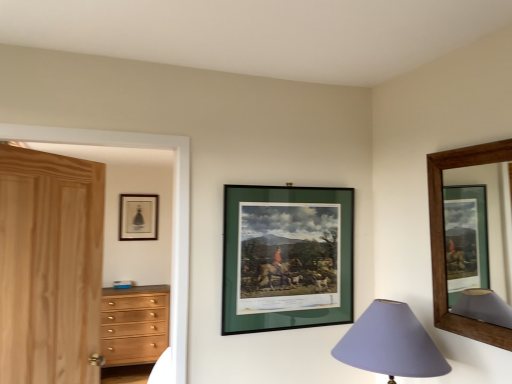
Question: Could you tell me if brown wooden picture frame at upper right, the third picture frame in the back-to-front sequence, is facing natural wood door at left?

Choices:
 (A) no
 (B) yes

Answer: (A)

Question: Is natural wood door at left inside brown wooden picture frame at upper right, which is the 3th picture frame in left-to-right order?

Choices:
 (A) yes
 (B) no

Answer: (B)

Question: From a real-world perspective, is brown wooden picture frame at upper right, acting as the 1th picture frame starting from the front, under natural wood door at left?

Choices:
 (A) no
 (B) yes

Answer: (A)

Question: From a real-world perspective, is brown wooden picture frame at upper right, marked as the 1th picture frame in a right-to-left arrangement, on top of natural wood door at left?

Choices:
 (A) no
 (B) yes

Answer: (B)

Question: From the image's perspective, is brown wooden picture frame at upper right, which is the 3th picture frame in left-to-right order, below natural wood door at left?

Choices:
 (A) no
 (B) yes

Answer: (A)

Question: Based on their positions, is green matte picture frame at center, which ranks as the second picture frame in left-to-right order, located to the left or right of natural wood door at left?

Choices:
 (A) left
 (B) right

Answer: (B)

Question: From the image's perspective, is green matte picture frame at center, which ranks as the second picture frame in left-to-right order, positioned above or below natural wood door at left?

Choices:
 (A) below
 (B) above

Answer: (B)

Question: From a real-world perspective, relative to natural wood door at left, is green matte picture frame at center, the second picture frame positioned from the right, vertically above or below?

Choices:
 (A) above
 (B) below

Answer: (A)

Question: Is green matte picture frame at center, which is the 2th picture frame from back to front, taller or shorter than natural wood door at left?

Choices:
 (A) tall
 (B) short

Answer: (B)

Question: Would you say green matte picture frame at center, the second picture frame positioned from the right, is to the left or to the right of brown wooden picture frame at upper right, acting as the 1th picture frame starting from the front, in the picture?

Choices:
 (A) right
 (B) left

Answer: (B)

Question: Is green matte picture frame at center, arranged as the 2th picture frame when viewed from the front, wider or thinner than brown wooden picture frame at upper right, the third picture frame in the back-to-front sequence?

Choices:
 (A) wide
 (B) thin

Answer: (B)

Question: Is point (286, 223) positioned closer to the camera than point (435, 304)?

Choices:
 (A) farther
 (B) closer

Answer: (A)

Question: Considering the positions of green matte picture frame at center, arranged as the 2th picture frame when viewed from the front, and brown wooden picture frame at upper right, the third picture frame in the back-to-front sequence, in the image, is green matte picture frame at center, arranged as the 2th picture frame when viewed from the front, taller or shorter than brown wooden picture frame at upper right, the third picture frame in the back-to-front sequence,?

Choices:
 (A) tall
 (B) short

Answer: (B)

Question: Based on their positions, is purple fabric lampshade at lower right located to the left or right of green matte picture frame at center, arranged as the 2th picture frame when viewed from the front?

Choices:
 (A) right
 (B) left

Answer: (A)

Question: Considering the positions of point click(389, 337) and point click(256, 278), is point click(389, 337) closer or farther from the camera than point click(256, 278)?

Choices:
 (A) closer
 (B) farther

Answer: (A)